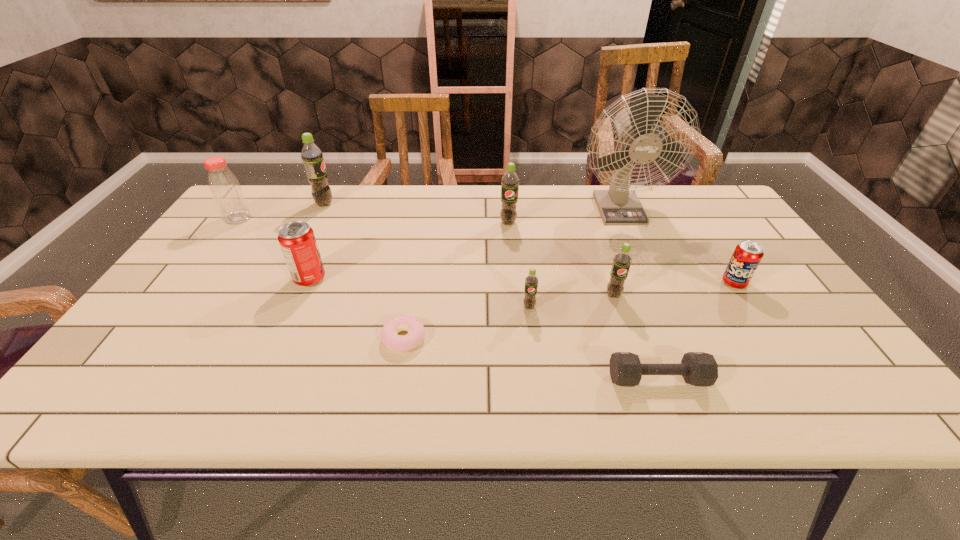
This screenshot has width=960, height=540. What are the coordinates of `vacant space at the near left corner of the desktop` in the screenshot? It's located at (105, 377).

Where is `vacant space at the far right corner of the desktop`? vacant space at the far right corner of the desktop is located at coordinates (688, 220).

Find the location of a particular element. free space between the second smallest green soda and the nearest soda is located at coordinates point(571,301).

In order to click on vacant space that is in between the tallest object and the bigger red soda can in this screenshot , I will do `click(464, 243)`.

Locate an element on the screen. unoccupied area between the tallest object and the leftmost object is located at coordinates (428, 213).

The image size is (960, 540). I want to click on free space that is in between the bigger red soda can and the third farthest green soda, so click(462, 287).

Find the location of a particular element. Image resolution: width=960 pixels, height=540 pixels. unoccupied area between the ninth shortest object and the nearest soda is located at coordinates (427, 255).

Image resolution: width=960 pixels, height=540 pixels. In order to click on vacant point located between the rightmost object and the fifth soda from left to right in this screenshot , I will do `click(674, 289)`.

The width and height of the screenshot is (960, 540). In order to click on free space between the rightmost object and the shortest object in this screenshot , I will do `click(569, 310)`.

Locate an element on the screen. free space between the third nearest object and the gray fan is located at coordinates (574, 257).